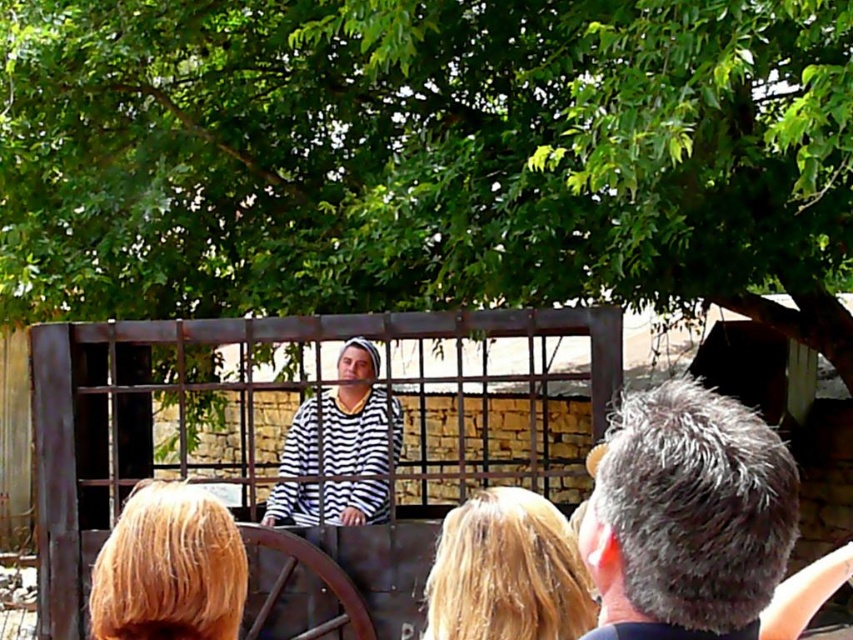
Can you confirm if blonde hair at center is shorter than blonde hair at lower left?

Incorrect, blonde hair at center's height does not fall short of blonde hair at lower left's.

Does blonde hair at center appear on the left side of blonde hair at lower left?

In fact, blonde hair at center is to the right of blonde hair at lower left.

Where is `blonde hair at center`? blonde hair at center is located at coordinates [508, 572].

Describe the element at coordinates (695, 522) in the screenshot. The image size is (853, 640). I see `gray matte hair at upper right` at that location.

Can you confirm if gray matte hair at upper right is wider than blonde hair at center?

Yes, gray matte hair at upper right is wider than blonde hair at center.

Locate an element on the screen. This screenshot has height=640, width=853. gray matte hair at upper right is located at coordinates (695, 522).

Can you confirm if rusty metal cage at center is taller than blonde hair at lower left?

Yes.

Measure the distance between point [466,477] and camera.

Point [466,477] and camera are 5.75 meters apart.

This screenshot has height=640, width=853. I want to click on rusty metal cage at center, so click(287, 426).